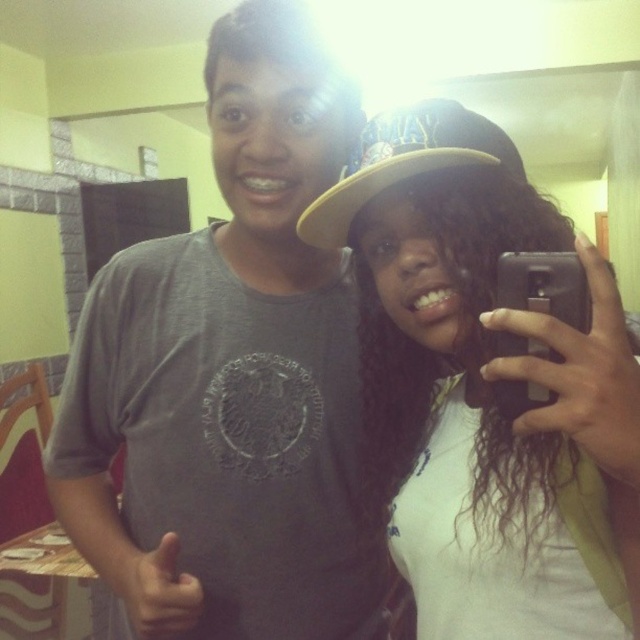
Question: Is white matte hat at upper center to the right of tan fabric baseball cap at upper right from the viewer's perspective?

Choices:
 (A) yes
 (B) no

Answer: (A)

Question: Can you confirm if white matte hat at upper center is bigger than tan fabric baseball cap at upper right?

Choices:
 (A) yes
 (B) no

Answer: (A)

Question: Which point is farther from the camera taking this photo?

Choices:
 (A) pos(348,227)
 (B) pos(440,243)

Answer: (A)

Question: Is white matte hat at upper center to the right of tan fabric baseball cap at upper right from the viewer's perspective?

Choices:
 (A) no
 (B) yes

Answer: (B)

Question: Which object appears farthest from the camera in this image?

Choices:
 (A) white matte hat at upper center
 (B) tan fabric baseball cap at upper right

Answer: (B)